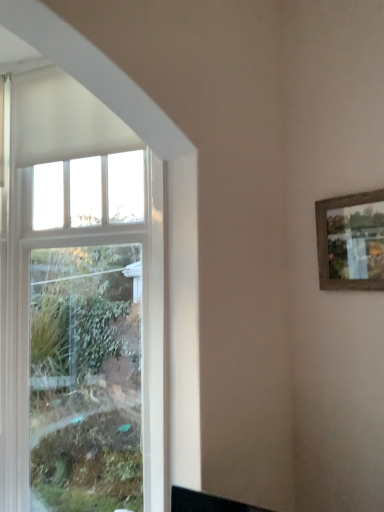
Question: Is wooden-framed picture at upper right taller or shorter than white glass window at left?

Choices:
 (A) short
 (B) tall

Answer: (A)

Question: From a real-world perspective, is wooden-framed picture at upper right positioned above or below white glass window at left?

Choices:
 (A) below
 (B) above

Answer: (B)

Question: Is wooden-framed picture at upper right spatially inside white glass window at left, or outside of it?

Choices:
 (A) outside
 (B) inside

Answer: (A)

Question: From the image's perspective, relative to wooden-framed picture at upper right, is white glass window at left above or below?

Choices:
 (A) above
 (B) below

Answer: (B)

Question: Is white glass window at left bigger or smaller than wooden-framed picture at upper right?

Choices:
 (A) big
 (B) small

Answer: (A)

Question: From a real-world perspective, relative to wooden-framed picture at upper right, is white glass window at left vertically above or below?

Choices:
 (A) above
 (B) below

Answer: (B)

Question: Is point (114, 415) positioned closer to the camera than point (322, 227)?

Choices:
 (A) farther
 (B) closer

Answer: (A)